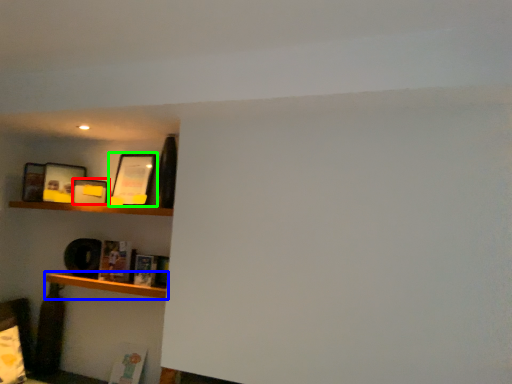
Question: Which is nearer to the picture frame (highlighted by a red box)? shelf (highlighted by a blue box) or picture frame (highlighted by a green box).

Choices:
 (A) shelf
 (B) picture frame

Answer: (B)